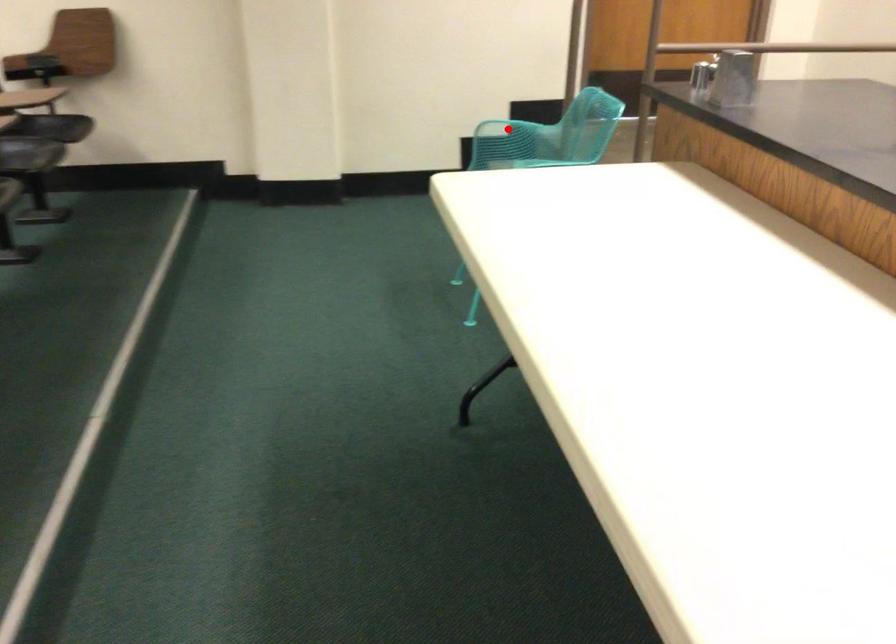
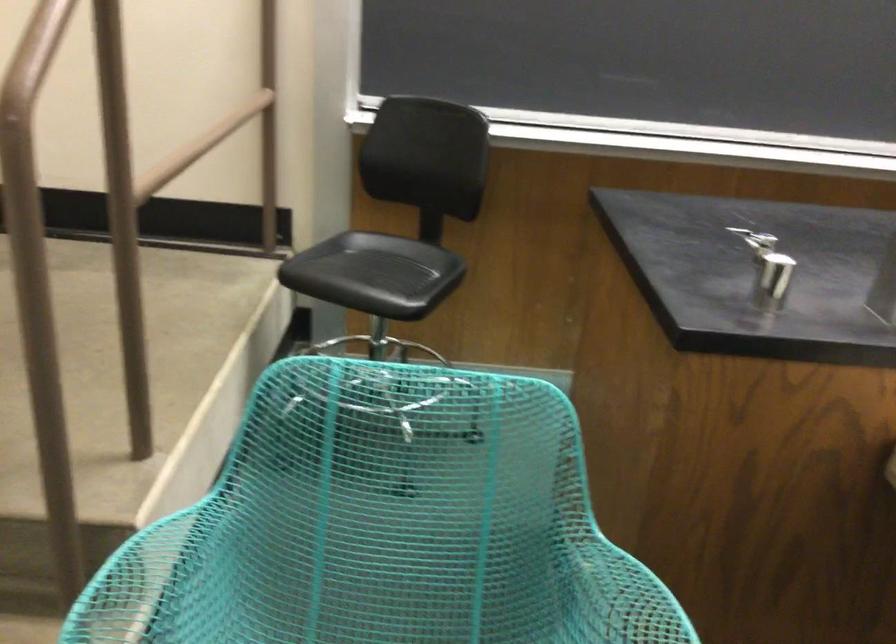
Locate, in the second image, the point that corresponds to the highlighted location in the first image.

(150, 582)